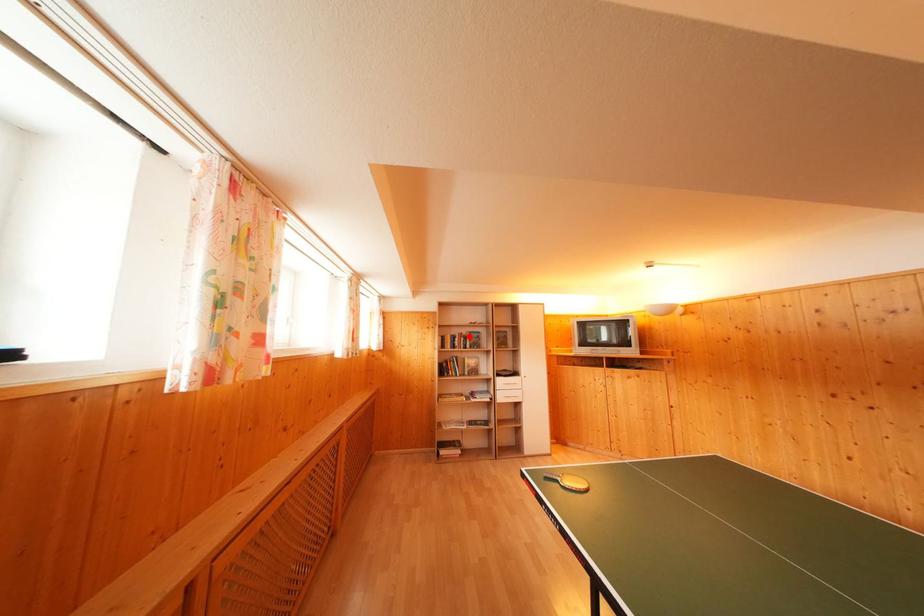
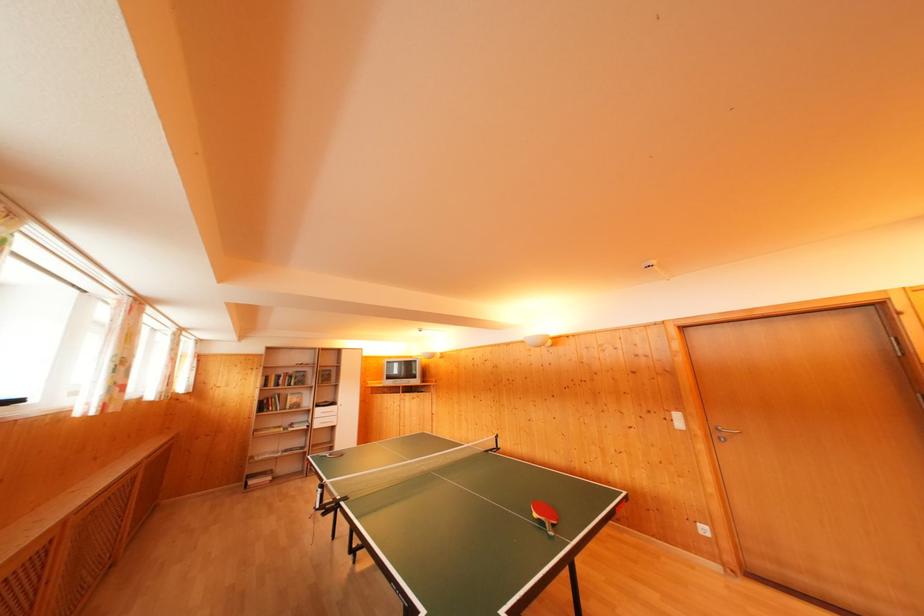
Where in the second image is the point corresponding to the highlighted location from the first image?

(296, 376)